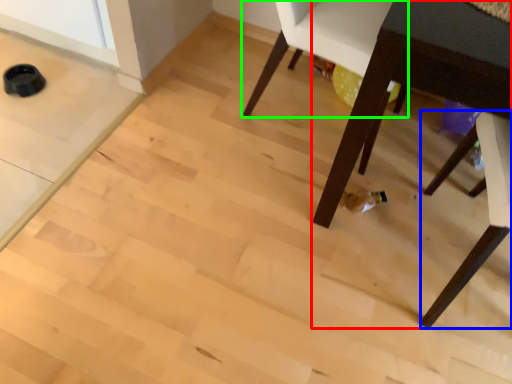
Question: Estimate the real-world distances between objects in this image. Which object is farther from table (highlighted by a red box), chair (highlighted by a blue box) or chair (highlighted by a green box)?

Choices:
 (A) chair
 (B) chair

Answer: (B)